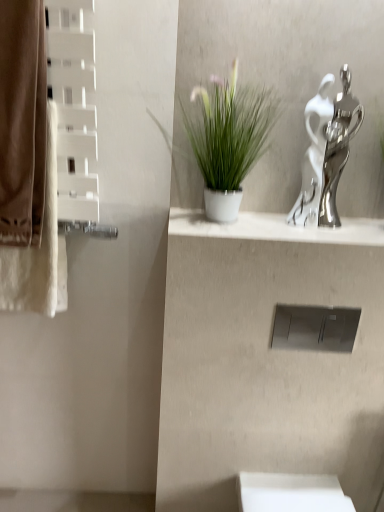
Where is `vacant area that is in front of silver metallic sculpture at upper right`? vacant area that is in front of silver metallic sculpture at upper right is located at coordinates (322, 231).